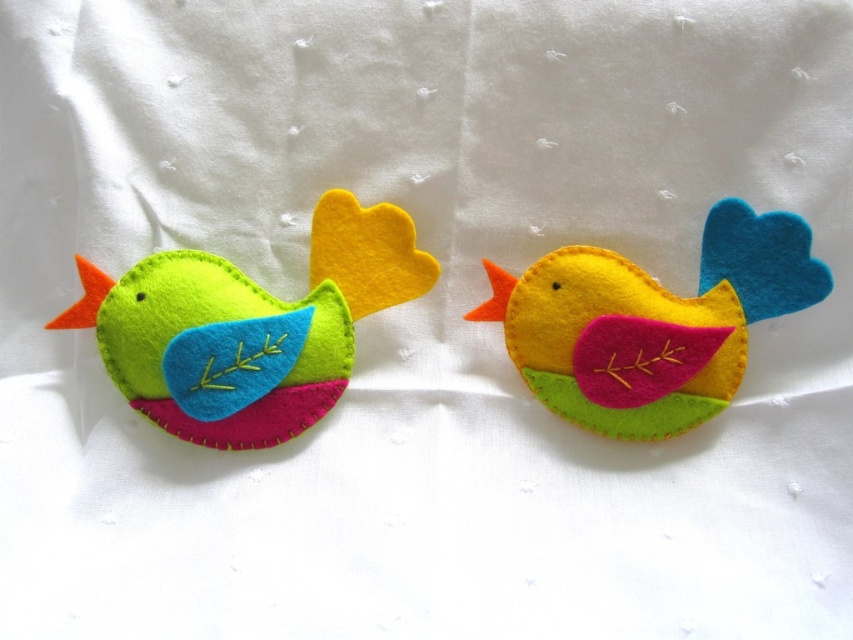
Does matte felt bird at left have a greater width compared to yellow felt bird at center?

Correct, the width of matte felt bird at left exceeds that of yellow felt bird at center.

Who is more forward, (223, 333) or (708, 356)?

Point (223, 333)

Is point (206, 364) farther from viewer compared to point (646, 284)?

That is False.

The height and width of the screenshot is (640, 853). I want to click on matte felt bird at left, so click(248, 326).